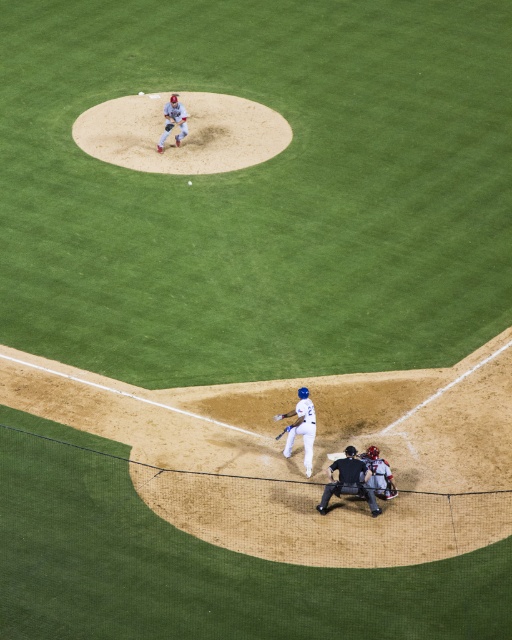
Question: Among these points, which one is nearest to the camera?

Choices:
 (A) (166, 120)
 (B) (384, 484)

Answer: (B)

Question: Which point is farther from the camera taking this photo?

Choices:
 (A) (289, 429)
 (B) (166, 120)

Answer: (B)

Question: Is white uniform glove at center further to the viewer compared to dark brown leather glove at lower center?

Choices:
 (A) yes
 (B) no

Answer: (A)

Question: Does black leather umpire at lower center appear under gray matte catcher at lower center?

Choices:
 (A) yes
 (B) no

Answer: (A)

Question: Can you confirm if gray matte catcher at lower center is positioned below dark brown leather glove at lower center?

Choices:
 (A) yes
 (B) no

Answer: (A)

Question: Considering the real-world distances, which object is farthest from the white uniform glove at center?

Choices:
 (A) gray matte catcher at lower center
 (B) brown leather glove at lower center
 (C) white matte baseball bat at lower center
 (D) brown leather glove at upper center

Answer: (A)